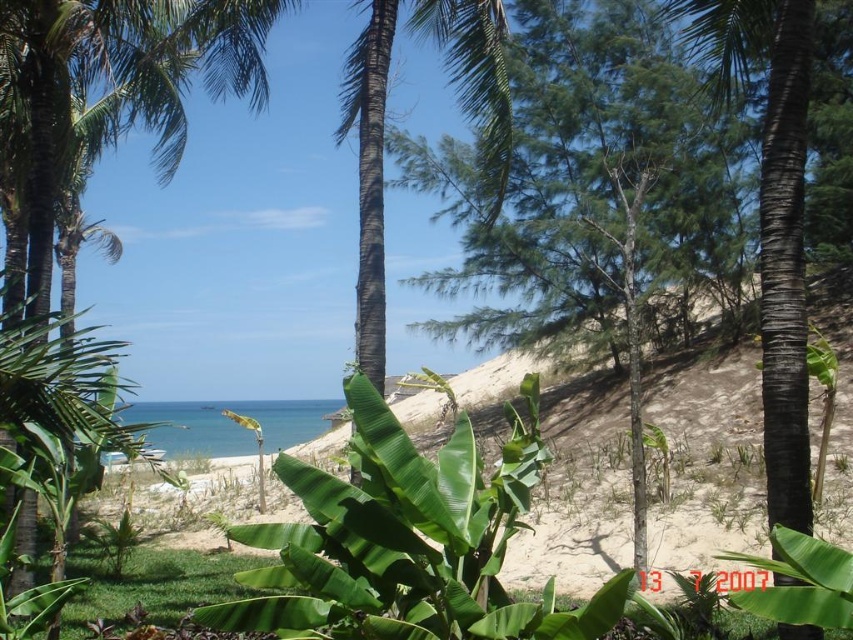
You are standing on the tropical beach and want to take a photo of both the green leafy palm tree at left and the black textured palm tree at center. Which palm tree will appear wider in the photo?

The black textured palm tree at center is wider than the green leafy palm tree at left, so it will appear wider in the photo.